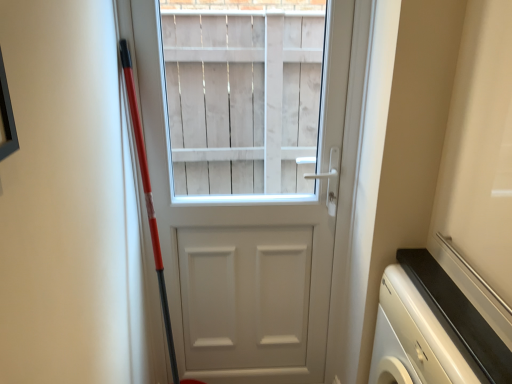
Question: From a real-world perspective, is white matte door at center beneath white glossy dishwasher at lower right?

Choices:
 (A) no
 (B) yes

Answer: (A)

Question: Does white matte door at center touch white glossy dishwasher at lower right?

Choices:
 (A) yes
 (B) no

Answer: (B)

Question: Would you say white matte door at center is a long distance from white glossy dishwasher at lower right?

Choices:
 (A) no
 (B) yes

Answer: (A)

Question: Is white matte door at center bigger than white glossy dishwasher at lower right?

Choices:
 (A) no
 (B) yes

Answer: (A)

Question: Is white matte door at center positioned behind white glossy dishwasher at lower right?

Choices:
 (A) yes
 (B) no

Answer: (A)

Question: Is white glossy dishwasher at lower right surrounded by white matte door at center?

Choices:
 (A) no
 (B) yes

Answer: (A)

Question: Would you say white glossy dishwasher at lower right is a long distance from white matte door at center?

Choices:
 (A) yes
 (B) no

Answer: (B)

Question: Is white glossy dishwasher at lower right facing towards white matte door at center?

Choices:
 (A) no
 (B) yes

Answer: (A)

Question: Is white glossy dishwasher at lower right looking in the opposite direction of white matte door at center?

Choices:
 (A) no
 (B) yes

Answer: (A)

Question: From the image's perspective, is white glossy dishwasher at lower right on white matte door at center?

Choices:
 (A) yes
 (B) no

Answer: (B)

Question: Is white glossy dishwasher at lower right closer to the viewer compared to white matte door at center?

Choices:
 (A) yes
 (B) no

Answer: (A)

Question: Considering the relative sizes of white glossy dishwasher at lower right and white matte door at center in the image provided, is white glossy dishwasher at lower right smaller than white matte door at center?

Choices:
 (A) yes
 (B) no

Answer: (B)

Question: Would you say white matte door at center is inside or outside white glossy dishwasher at lower right?

Choices:
 (A) outside
 (B) inside

Answer: (A)